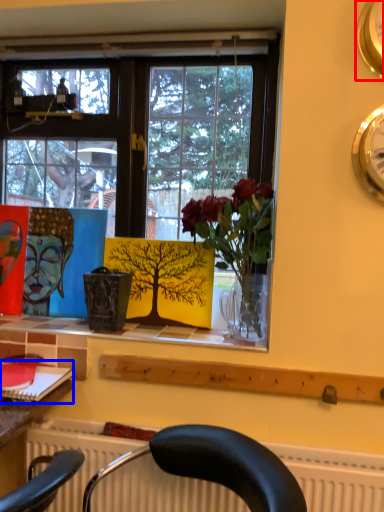
Question: Which point is closer to the camera, clock (highlighted by a red box) or book (highlighted by a blue box)?

Choices:
 (A) clock
 (B) book

Answer: (A)